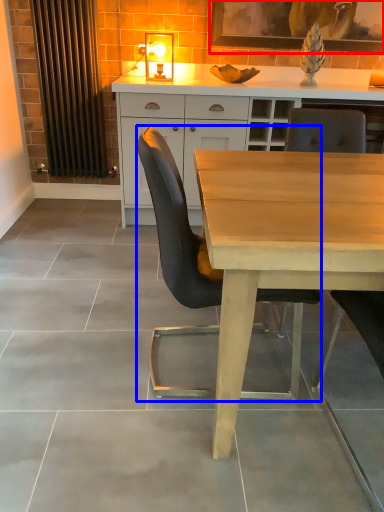
Question: Among these objects, which one is nearest to the camera, picture frame (highlighted by a red box) or chair (highlighted by a blue box)?

Choices:
 (A) picture frame
 (B) chair

Answer: (B)